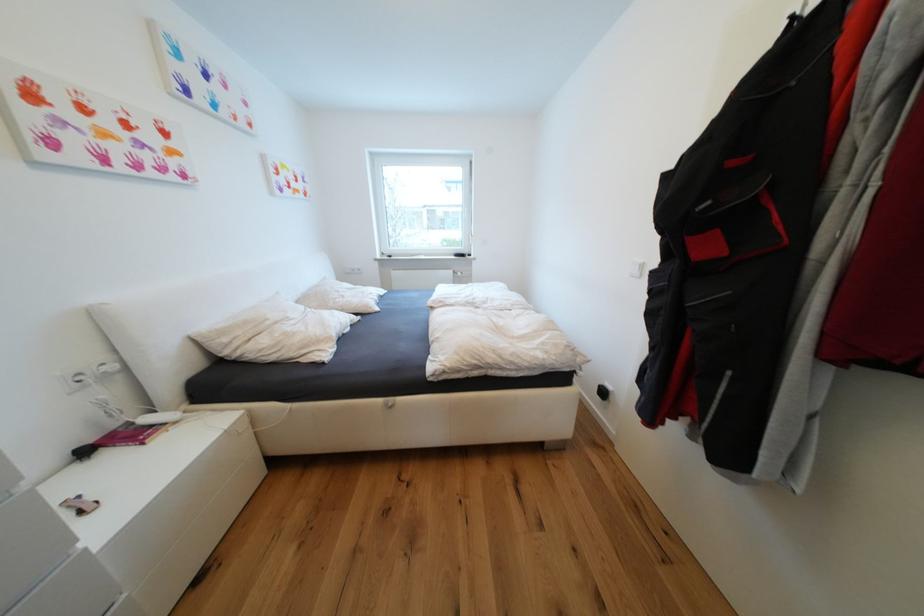
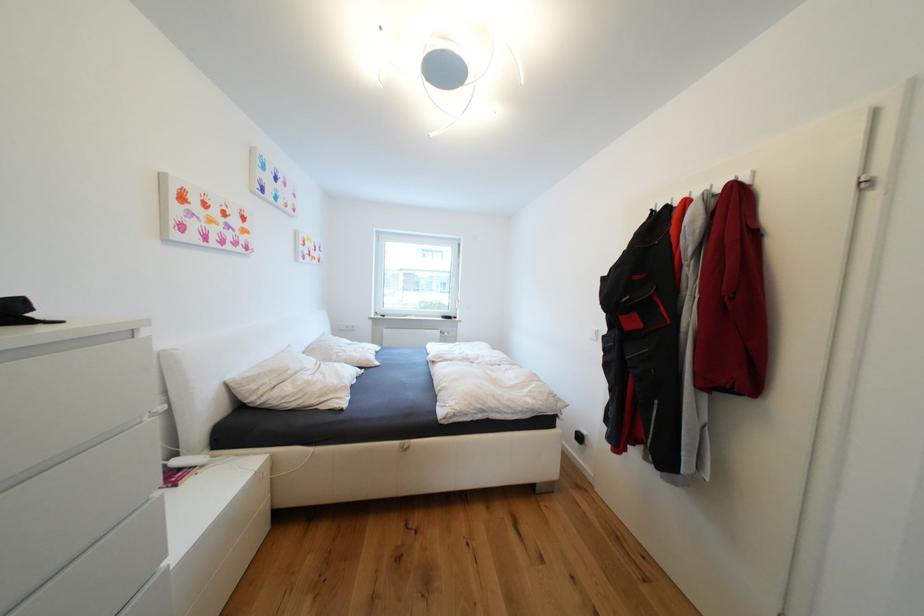
Where in the second image is the point corresponding to pixel 284 323 from the first image?

(304, 374)